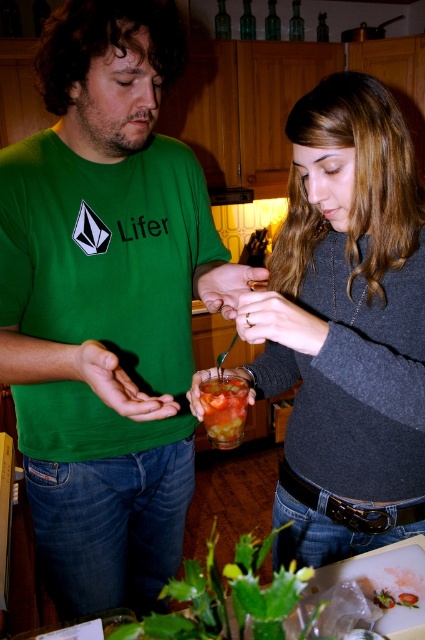
Question: Among these objects, which one is farthest from the camera?

Choices:
 (A) green t-shirt at center
 (B) strawberry jam jar at center
 (C) tomato soup at center

Answer: (B)

Question: Can you confirm if green t-shirt at center is positioned to the left of tomato soup at center?

Choices:
 (A) no
 (B) yes

Answer: (B)

Question: Estimate the real-world distances between objects in this image. Which object is closer to the matte gray sweater at center?

Choices:
 (A) strawberry jam jar at center
 (B) tomato soup at center

Answer: (B)

Question: Observing the image, what is the correct spatial positioning of green t-shirt at center in reference to tomato soup at center?

Choices:
 (A) below
 (B) above

Answer: (B)

Question: Where is green t-shirt at center located in relation to matte gray sweater at center in the image?

Choices:
 (A) below
 (B) above

Answer: (A)

Question: Among these points, which one is nearest to the camera?

Choices:
 (A) [x=396, y=602]
 (B) [x=368, y=460]
 (C) [x=73, y=204]
 (D) [x=229, y=384]

Answer: (A)